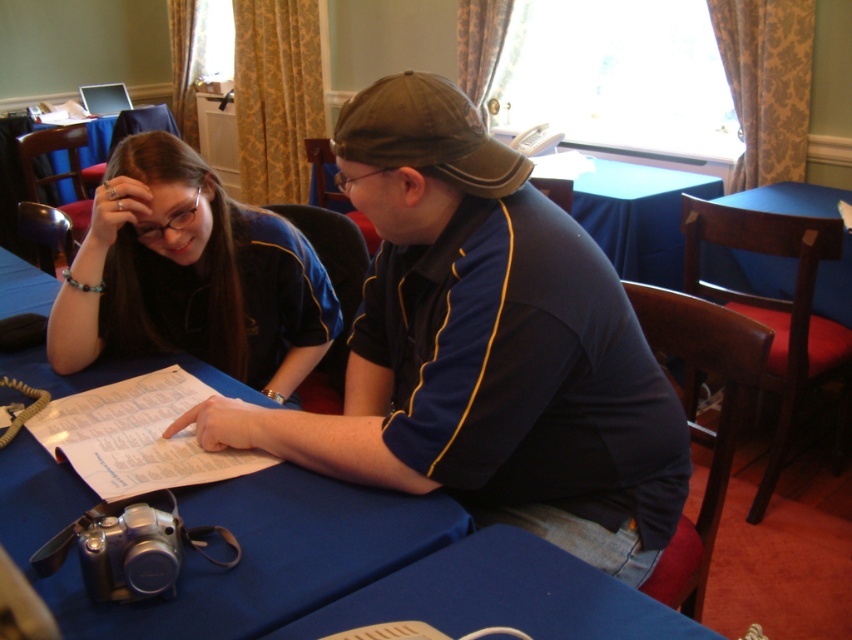
Question: Is dark blue jersey at center closer to the viewer compared to blue fabric table at lower center?

Choices:
 (A) yes
 (B) no

Answer: (B)

Question: Which point is farther from the camera taking this photo?

Choices:
 (A) (533, 484)
 (B) (332, 548)

Answer: (A)

Question: From the image, what is the correct spatial relationship of dark blue jersey at center in relation to blue fabric table at lower center?

Choices:
 (A) right
 (B) left

Answer: (B)

Question: Can you confirm if dark blue jersey at center is bigger than blue fabric table at center?

Choices:
 (A) yes
 (B) no

Answer: (A)

Question: Which of the following is the farthest from the observer?

Choices:
 (A) (346, 506)
 (B) (183, 168)
 (C) (622, 442)
 (D) (540, 600)

Answer: (B)

Question: Considering the real-world distances, which object is closest to the matte black shirt at center?

Choices:
 (A) dark blue jersey at center
 (B) blue fabric table at lower center
 (C) blue fabric table at center

Answer: (C)